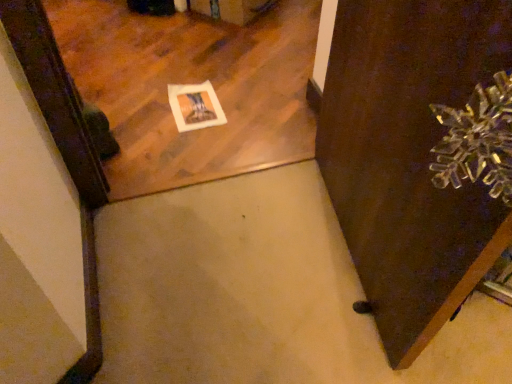
Locate an element on the screen. vacant space positioned to the left of brown wooden door at right is located at coordinates pyautogui.click(x=231, y=253).